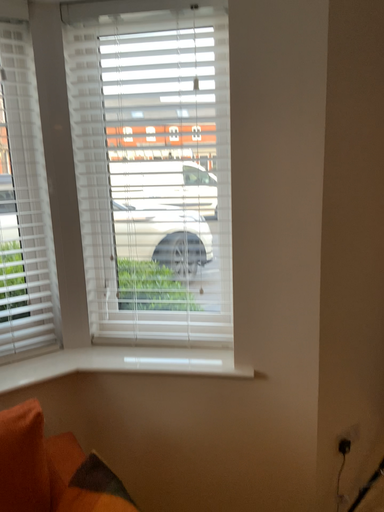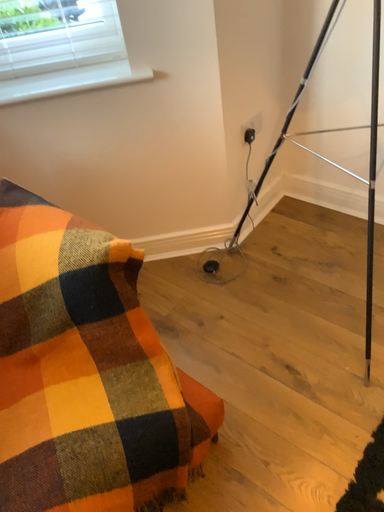
Question: How did the camera likely rotate when shooting the video?

Choices:
 (A) rotated left
 (B) rotated right

Answer: (B)